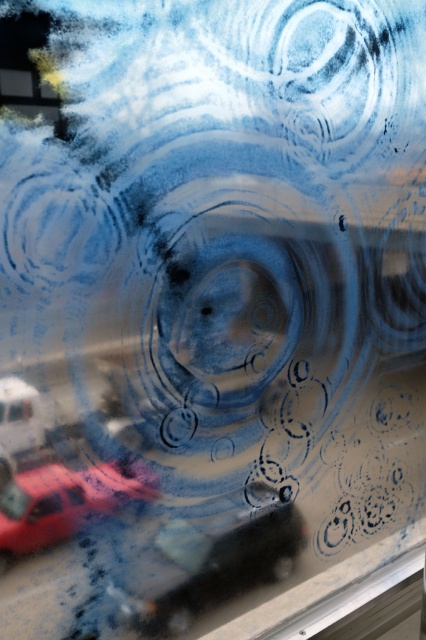
This screenshot has width=426, height=640. Describe the element at coordinates (215, 563) in the screenshot. I see `shiny black car at center` at that location.

Is point (201, 534) more distant than point (92, 506)?

Yes.

Image resolution: width=426 pixels, height=640 pixels. I want to click on shiny black car at center, so click(215, 563).

The height and width of the screenshot is (640, 426). Find the location of `shiny black car at center`. shiny black car at center is located at coordinates (215, 563).